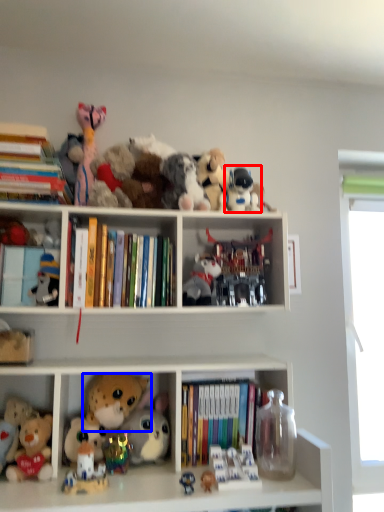
Question: Among these objects, which one is nearest to the camera, toy (highlighted by a red box) or toy (highlighted by a blue box)?

Choices:
 (A) toy
 (B) toy

Answer: (B)